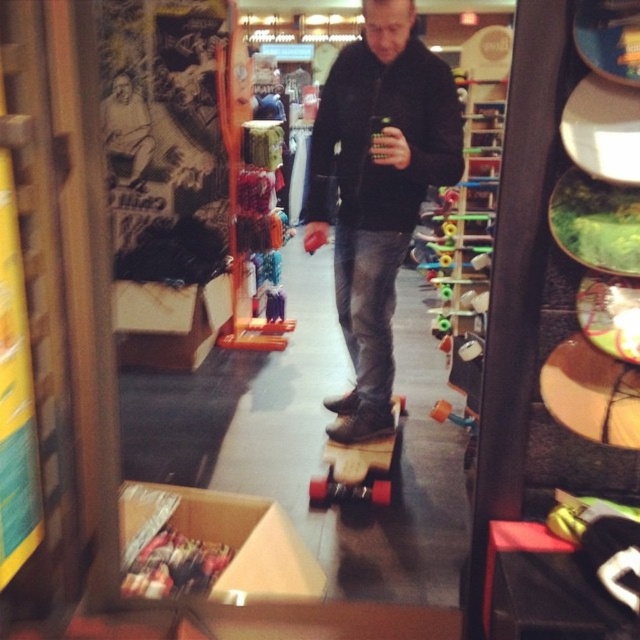
Question: Does black leather jacket at center have a larger size compared to wooden deck skateboard at center?

Choices:
 (A) no
 (B) yes

Answer: (B)

Question: Among these objects, which one is nearest to the camera?

Choices:
 (A) wooden skateboard at center
 (B) wooden deck skateboard at center
 (C) black leather jacket at center

Answer: (A)

Question: Does wooden skateboard at center lie behind black leather jacket at center?

Choices:
 (A) no
 (B) yes

Answer: (A)

Question: From the image, what is the correct spatial relationship of wooden skateboard at center in relation to black leather jacket at center?

Choices:
 (A) right
 (B) left

Answer: (B)

Question: Which object is the farthest from the black leather jacket at center?

Choices:
 (A) wooden skateboard at center
 (B) wooden deck skateboard at center

Answer: (B)

Question: Estimate the real-world distances between objects in this image. Which object is farther from the wooden deck skateboard at center?

Choices:
 (A) wooden skateboard at center
 (B) black leather jacket at center

Answer: (B)